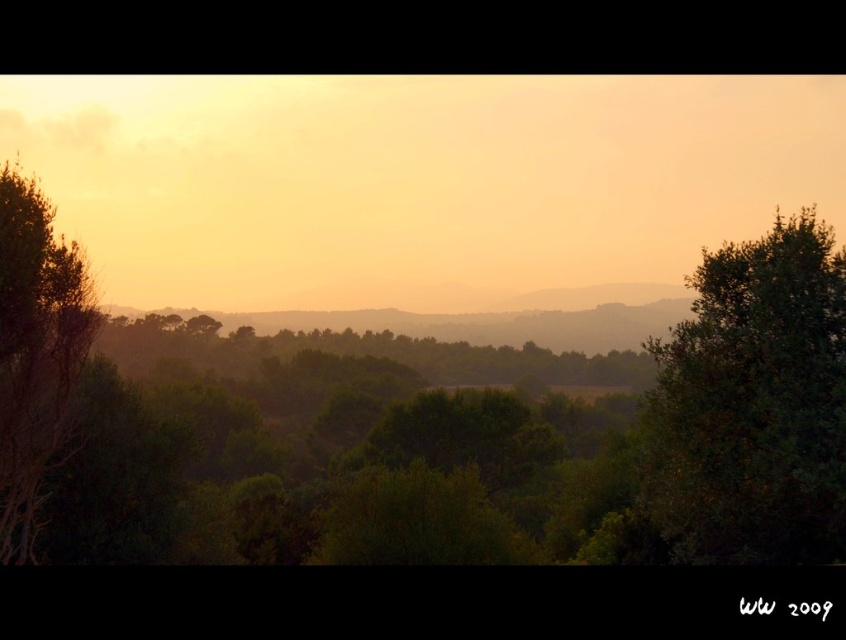
You are standing in the middle of the landscape and want to take a photo of both the green leafy tree at right and the green leafy tree at left. Which tree should you position closer to the camera to include both in the frame without cropping?

To include both the green leafy tree at right and the green leafy tree at left in the frame without cropping, you should position the green leafy tree at right closer to the camera since it is shorter than the green leafy tree at left. This way, the taller tree at left will occupy more vertical space, while the shorter one at right can be placed near the foreground, ensuring both fit within the photo.

Based on the photo, you are standing in the serene landscape scene. There is a green leafy tree at right. Where is the point at coordinate (x=754, y=403) located?

The point at coordinate (x=754, y=403) is located on the green leafy tree at right.

You are an environmental scientist studying tree growth in this area. You observe the green leafy tree at right and the green leafy tree at left. Which tree would likely have a wider canopy, and why?

The green leafy tree at right has a larger size compared to the green leafy tree at left, so it likely has a wider canopy because larger trees typically have broader canopies.